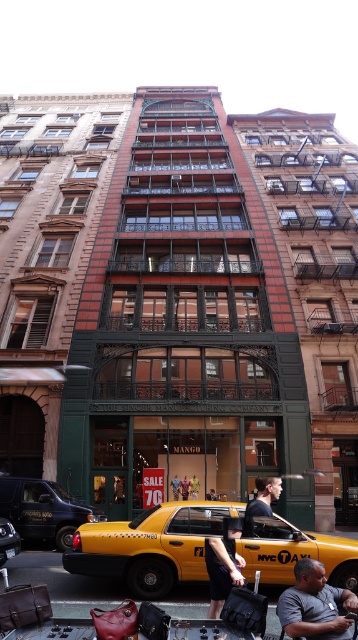
Is yellow matte taxi at center thinner than dark skin textured shirt at center?

No.

Who is lower down, yellow matte taxi at center or dark skin textured shirt at center?

yellow matte taxi at center is lower down.

Image resolution: width=358 pixels, height=640 pixels. What do you see at coordinates (151, 545) in the screenshot? I see `yellow matte taxi at center` at bounding box center [151, 545].

I want to click on yellow matte taxi at center, so click(151, 545).

Is the position of smooth leather handbags at lower center more distant than that of dark blue shirt at center?

That is False.

Which is in front, point (171, 612) or point (243, 532)?

Point (171, 612)

Is point (276, 616) positioned behind point (247, 502)?

No, it is in front of (247, 502).

Image resolution: width=358 pixels, height=640 pixels. What are the coordinates of `smooth leather handbags at lower center` in the screenshot? It's located at (64, 582).

Does smooth leather handbags at lower center appear on the right side of dark gray fabric pants at lower center?

In fact, smooth leather handbags at lower center is to the left of dark gray fabric pants at lower center.

Does smooth leather handbags at lower center have a lesser height compared to dark gray fabric pants at lower center?

Incorrect, smooth leather handbags at lower center's height does not fall short of dark gray fabric pants at lower center's.

Is point (74, 605) farther from viewer compared to point (219, 608)?

Yes, point (74, 605) is farther from viewer.

You are a GUI agent. You are given a task and a screenshot of the screen. Output one action in this format:
    pyautogui.click(x=<x>, y=<y>)
    Task: Click on the smooth leather handbags at lower center
    
    Given the screenshot: What is the action you would take?
    pyautogui.click(x=64, y=582)